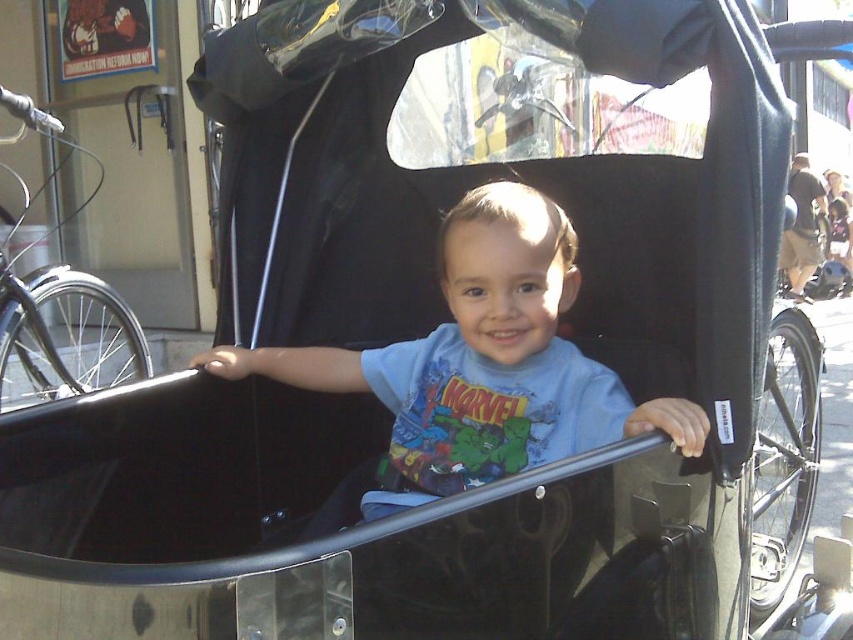
Question: Can you confirm if light blue cotton shirt at center is bigger than brown fabric coach at right?

Choices:
 (A) no
 (B) yes

Answer: (A)

Question: Is light blue cotton shirt at center smaller than brown fabric coach at right?

Choices:
 (A) no
 (B) yes

Answer: (B)

Question: Does light blue cotton shirt at center have a smaller size compared to brown fabric coach at right?

Choices:
 (A) yes
 (B) no

Answer: (A)

Question: Which of the following is the closest to the observer?

Choices:
 (A) brown fabric coach at right
 (B) light blue cotton shirt at center

Answer: (B)

Question: Among these objects, which one is farthest from the camera?

Choices:
 (A) light blue cotton shirt at center
 (B) brown fabric coach at right

Answer: (B)